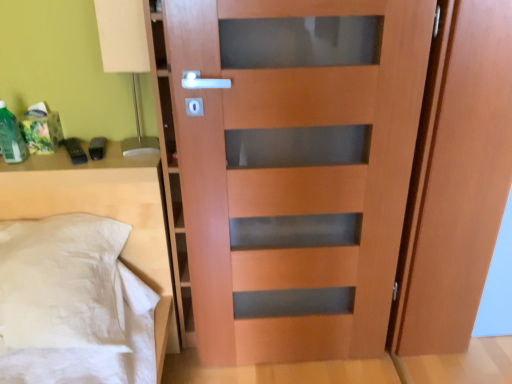
Question: Could you tell me if matte wood screen door at right is turned towards white matte table lamp at upper left?

Choices:
 (A) yes
 (B) no

Answer: (A)

Question: Are matte wood screen door at right and white matte table lamp at upper left located far from each other?

Choices:
 (A) yes
 (B) no

Answer: (A)

Question: Considering the relative positions of matte wood screen door at right and white matte table lamp at upper left in the image provided, is matte wood screen door at right behind white matte table lamp at upper left?

Choices:
 (A) yes
 (B) no

Answer: (B)

Question: Can you confirm if matte wood screen door at right is taller than white matte table lamp at upper left?

Choices:
 (A) yes
 (B) no

Answer: (A)

Question: Is matte wood screen door at right bigger than white matte table lamp at upper left?

Choices:
 (A) no
 (B) yes

Answer: (B)

Question: From the image's perspective, is white matte table lamp at upper left above or below matte wood screen door at right?

Choices:
 (A) below
 (B) above

Answer: (B)

Question: From a real-world perspective, relative to matte wood screen door at right, is white matte table lamp at upper left vertically above or below?

Choices:
 (A) below
 (B) above

Answer: (B)

Question: Is white matte table lamp at upper left wider or thinner than matte wood screen door at right?

Choices:
 (A) wide
 (B) thin

Answer: (B)

Question: From their relative heights in the image, would you say white matte table lamp at upper left is taller or shorter than matte wood screen door at right?

Choices:
 (A) tall
 (B) short

Answer: (B)

Question: Is green matte bottle at left to the left or to the right of matte wood door at center in the image?

Choices:
 (A) left
 (B) right

Answer: (A)

Question: From the image's perspective, is green matte bottle at left located above or below matte wood door at center?

Choices:
 (A) below
 (B) above

Answer: (B)

Question: Based on their sizes in the image, would you say green matte bottle at left is bigger or smaller than matte wood door at center?

Choices:
 (A) big
 (B) small

Answer: (B)

Question: Is point (14, 134) positioned closer to the camera than point (376, 158)?

Choices:
 (A) farther
 (B) closer

Answer: (A)

Question: From the image's perspective, is green matte bottle at left positioned above or below white fabric pillow at left?

Choices:
 (A) above
 (B) below

Answer: (A)

Question: Is point (10, 122) positioned closer to the camera than point (44, 168)?

Choices:
 (A) farther
 (B) closer

Answer: (A)